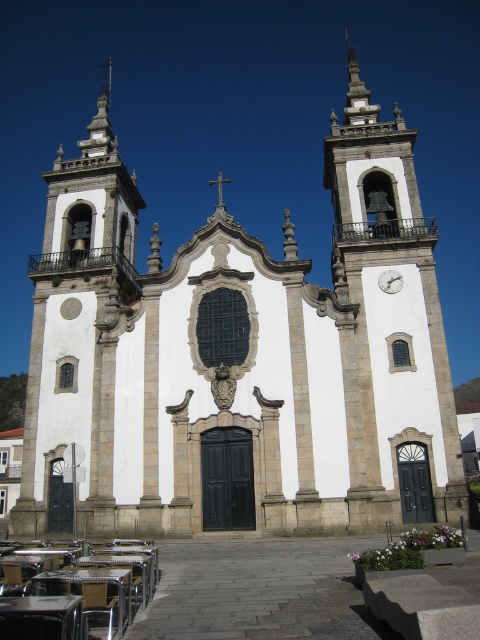
You are an architect designing a new church and want to ensure the proportions between the white stone bell tower at left and the metallic silver clock at upper right are accurate. Based on the image, which object has a greater width?

The white stone bell tower at left has a greater width than the metallic silver clock at upper right.

You are standing in front of the grand church and want to check the time. You see the white stone clock tower at upper center and the metallic silver clock at upper right. Which clock is easier to read from your current position?

The white stone clock tower at upper center is closer to the viewer than the metallic silver clock at upper right, so it is easier to read from your current position.